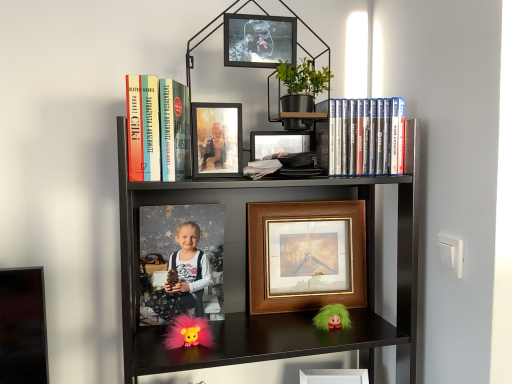
This screenshot has height=384, width=512. In order to click on black matte bookcase at upper center in this screenshot , I will do `click(286, 187)`.

Locate an element on the screen. woodenobject at center, placed as the 4th picture frame when sorted from front to back is located at coordinates point(306,255).

This screenshot has height=384, width=512. I want to click on metallic photo frame at upper center, which is the first picture frame in top-to-bottom order, so click(259, 40).

In order to face hardcover book at upper left, which ranks as the second book in right-to-left order, should I rotate leftwards or rightwards?

You should rotate left by 12.518 degrees.

Where is `black matte bookcase at upper center`? The image size is (512, 384). black matte bookcase at upper center is located at coordinates (286, 187).

Looking at this image, is wooden picture frame at lower center, positioned as the fourth picture frame in top-to-bottom order, at the right side of metallic photo frame at upper center, the 1th picture frame from the front?

Yes, wooden picture frame at lower center, positioned as the fourth picture frame in top-to-bottom order, is to the right of metallic photo frame at upper center, the 1th picture frame from the front.

Which is behind, wooden picture frame at lower center, arranged as the 1th picture frame when ordered from the bottom, or metallic photo frame at upper center, the 4th picture frame in the bottom-to-top sequence?

wooden picture frame at lower center, arranged as the 1th picture frame when ordered from the bottom, is more distant.

Is wooden picture frame at lower center, positioned as the fourth picture frame in top-to-bottom order, in contact with metallic photo frame at upper center, which is the first picture frame in top-to-bottom order?

No, wooden picture frame at lower center, positioned as the fourth picture frame in top-to-bottom order, is not in contact with metallic photo frame at upper center, which is the first picture frame in top-to-bottom order.

Consider the image. Which is correct: wooden picture frame at lower center, the 3th picture frame viewed from the front, is inside metallic photo frame at upper center, which is the first picture frame in top-to-bottom order, or outside of it?

wooden picture frame at lower center, the 3th picture frame viewed from the front, is spatially situated outside metallic photo frame at upper center, which is the first picture frame in top-to-bottom order.

Which object is thinner, wooden picture frame at lower center, the second picture frame when ordered from back to front, or matte black dress at center?

With smaller width is matte black dress at center.

Is wooden picture frame at lower center, arranged as the 1th picture frame when ordered from the bottom, in front of matte black dress at center?

That is False.

How far apart are wooden picture frame at lower center, positioned as the fourth picture frame in top-to-bottom order, and matte black dress at center?

15.45 inches.

From the image's perspective, which object appears higher, wooden picture frame at lower center, arranged as the 1th picture frame when ordered from the bottom, or matte black dress at center?

matte black dress at center appears higher in the image.

From a real-world perspective, is fuzzy pink doll at lower center positioned under matte black dress at center based on gravity?

Yes, from a real-world perspective, fuzzy pink doll at lower center is beneath matte black dress at center.

Considering the positions of objects fuzzy pink doll at lower center and matte black dress at center in the image provided, who is more to the right, fuzzy pink doll at lower center or matte black dress at center?

Positioned to the right is fuzzy pink doll at lower center.

Which is behind, fuzzy pink doll at lower center or matte black dress at center?

matte black dress at center is further away from the camera.

Is fuzzy pink doll at lower center touching matte black dress at center?

No, fuzzy pink doll at lower center is not touching matte black dress at center.

How many degrees apart are the facing directions of hardcover book at upper left, which ranks as the second book in right-to-left order, and matte plastic dvds at upper right, which is the first book in right-to-left order?

The facing directions of hardcover book at upper left, which ranks as the second book in right-to-left order, and matte plastic dvds at upper right, which is the first book in right-to-left order, are 5.55 degrees apart.

Which point is more distant from viewer, (140, 139) or (375, 136)?

The point (375, 136) is farther from the camera.

I want to click on book beneath the hardcover book at upper left, which ranks as the second book in right-to-left order (from a real-world perspective), so click(366, 137).

Considering the relative sizes of hardcover book at upper left, which ranks as the second book in right-to-left order, and matte plastic dvds at upper right, which is the first book in right-to-left order, in the image provided, is hardcover book at upper left, which ranks as the second book in right-to-left order, bigger than matte plastic dvds at upper right, which is the first book in right-to-left order,?

Indeed, hardcover book at upper left, which ranks as the second book in right-to-left order, has a larger size compared to matte plastic dvds at upper right, which is the first book in right-to-left order.

Could you tell me if matte plastic dvds at upper right, which is the first book in right-to-left order, is facing fuzzy pink doll at lower center?

No, matte plastic dvds at upper right, which is the first book in right-to-left order, is not facing towards fuzzy pink doll at lower center.

Is matte plastic dvds at upper right, which is the second book in left-to-right order, far away from fuzzy pink doll at lower center?

No, there isn't a large distance between matte plastic dvds at upper right, which is the second book in left-to-right order, and fuzzy pink doll at lower center.

Is fuzzy pink doll at lower center surrounded by matte plastic dvds at upper right, which is the second book in left-to-right order?

No, matte plastic dvds at upper right, which is the second book in left-to-right order, does not contain fuzzy pink doll at lower center.

From a real-world perspective, which object stands above the other?

From a 3D spatial view, matte plastic dvds at upper right, which is the second book in left-to-right order, is above.

From the image's perspective, is fuzzy pink doll at lower center over black matte bookcase at upper center?

Incorrect, from the image's perspective, fuzzy pink doll at lower center is lower than black matte bookcase at upper center.

How many degrees apart are the facing directions of fuzzy pink doll at lower center and black matte bookcase at upper center?

They differ by 4.08 degrees in their facing directions.

Is point (173, 345) closer or farther from the camera than point (411, 250)?

Point (173, 345) appears to be closer to the viewer than point (411, 250).

Can you confirm if fuzzy pink doll at lower center is shorter than black matte bookcase at upper center?

Indeed, fuzzy pink doll at lower center has a lesser height compared to black matte bookcase at upper center.

From the image's perspective, which is below, matte plastic dvds at upper right, which is the second book in left-to-right order, or hardcover book at upper left, which ranks as the second book in right-to-left order?

matte plastic dvds at upper right, which is the second book in left-to-right order.

Is matte plastic dvds at upper right, which is the first book in right-to-left order, not within hardcover book at upper left, which ranks as the second book in right-to-left order?

Absolutely, matte plastic dvds at upper right, which is the first book in right-to-left order, is external to hardcover book at upper left, which ranks as the second book in right-to-left order.

Can you tell me how much matte plastic dvds at upper right, which is the second book in left-to-right order, and hardcover book at upper left, which appears as the 1th book when viewed from the left, differ in facing direction?

There is a 5.55-degree angle between the facing directions of matte plastic dvds at upper right, which is the second book in left-to-right order, and hardcover book at upper left, which appears as the 1th book when viewed from the left.

Does point (404, 155) appear closer or farther from the camera than point (182, 138)?

Point (404, 155).

Locate an element on the screen. This screenshot has height=384, width=512. the 3rd picture frame above the wooden picture frame at lower center, positioned as the fourth picture frame in top-to-bottom order (from the image's perspective) is located at coordinates (259, 40).

The image size is (512, 384). I want to click on picture frame that is the 4th object to the right of the matte black dress at center, starting at the anchor, so click(x=334, y=376).

Considering their positions, is hardcover book at upper left, which appears as the 1th book when viewed from the left, positioned further to woodenobject at center, the 1th picture frame viewed from the back, than metallic photo frame at upper center, the 1th picture frame from the front?

→ Based on the image, metallic photo frame at upper center, the 1th picture frame from the front, appears to be further to woodenobject at center, the 1th picture frame viewed from the back.

Looking at the image, which one is located closer to matte wooden photo frame at upper center, which is counted as the second picture frame, starting from the top, hardcover book at upper left, which appears as the 1th book when viewed from the left, or black matte bookcase at upper center?

hardcover book at upper left, which appears as the 1th book when viewed from the left, is closer to matte wooden photo frame at upper center, which is counted as the second picture frame, starting from the top.

Which object lies nearer to the anchor point hardcover book at upper left, which appears as the 1th book when viewed from the left, matte wooden photo frame at upper center, positioned as the third picture frame in bottom-to-top order, or fuzzy pink doll at lower center?

matte wooden photo frame at upper center, positioned as the third picture frame in bottom-to-top order.

Considering their positions, is hardcover book at upper left, which appears as the 1th book when viewed from the left, positioned closer to fuzzy pink doll at lower center than metallic photo frame at upper center, which is the 4th picture frame in back-to-front order?

Based on the image, hardcover book at upper left, which appears as the 1th book when viewed from the left, appears to be nearer to fuzzy pink doll at lower center.

Estimate the real-world distances between objects in this image. Which object is closer to hardcover book at upper left, which ranks as the second book in right-to-left order, black matte bookcase at upper center or matte black dress at center?

The object closer to hardcover book at upper left, which ranks as the second book in right-to-left order, is black matte bookcase at upper center.

Looking at the image, which one is located further to black matte bookcase at upper center, wooden picture frame at lower center, arranged as the 1th picture frame when ordered from the bottom, or fuzzy pink doll at lower center?

wooden picture frame at lower center, arranged as the 1th picture frame when ordered from the bottom, lies further to black matte bookcase at upper center than the other object.

When comparing their distances from black matte bookcase at upper center, does matte wooden photo frame at upper center, which is counted as the second picture frame, starting from the top, or matte plastic dvds at upper right, which is the first book in right-to-left order, seem closer?

Based on the image, matte plastic dvds at upper right, which is the first book in right-to-left order, appears to be nearer to black matte bookcase at upper center.

Considering their positions, is matte wooden photo frame at upper center, which is counted as the second picture frame, starting from the top, positioned closer to matte black dress at center than woodenobject at center, marked as the 2th picture frame in a bottom-to-top arrangement?

woodenobject at center, marked as the 2th picture frame in a bottom-to-top arrangement, is closer to matte black dress at center.

Image resolution: width=512 pixels, height=384 pixels. What are the coordinates of `person between matte wooden photo frame at upper center, positioned as the third picture frame in bottom-to-top order, and wooden picture frame at lower center, the second picture frame when ordered from back to front, from top to bottom` in the screenshot? It's located at [189, 268].

This screenshot has height=384, width=512. I want to click on person between hardcover book at upper left, which appears as the 1th book when viewed from the left, and black matte bookcase at upper center, in the vertical direction, so click(189, 268).

In order to click on person situated between hardcover book at upper left, which ranks as the second book in right-to-left order, and matte plastic dvds at upper right, which is the first book in right-to-left order, from left to right in this screenshot , I will do [x=189, y=268].

Locate an element on the screen. The width and height of the screenshot is (512, 384). bookcase between fuzzy pink doll at lower center and woodenobject at center, the 1th picture frame viewed from the back, in the horizontal direction is located at coordinates (286, 187).